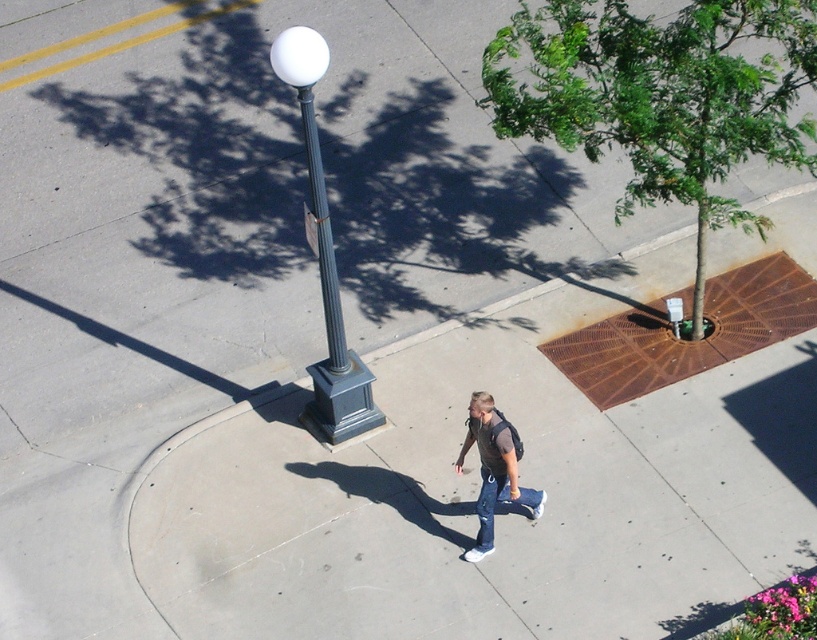
You are a photographer trying to capture the person in the image. The denim jeans at center and denim at center are both visible in your viewfinder. Which one is positioned higher relative to the other?

The denim jeans at center is positioned higher than the denim at center.